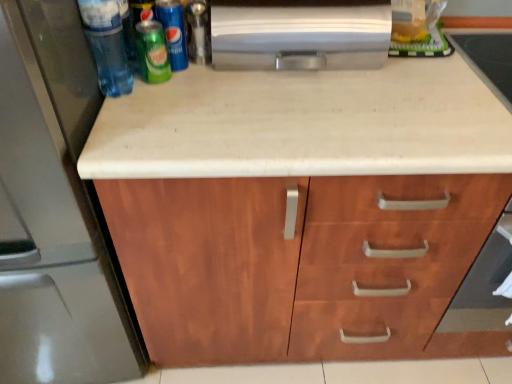
Where is `free location in front of translucent plastic bottle at upper left`? free location in front of translucent plastic bottle at upper left is located at coordinates (132, 130).